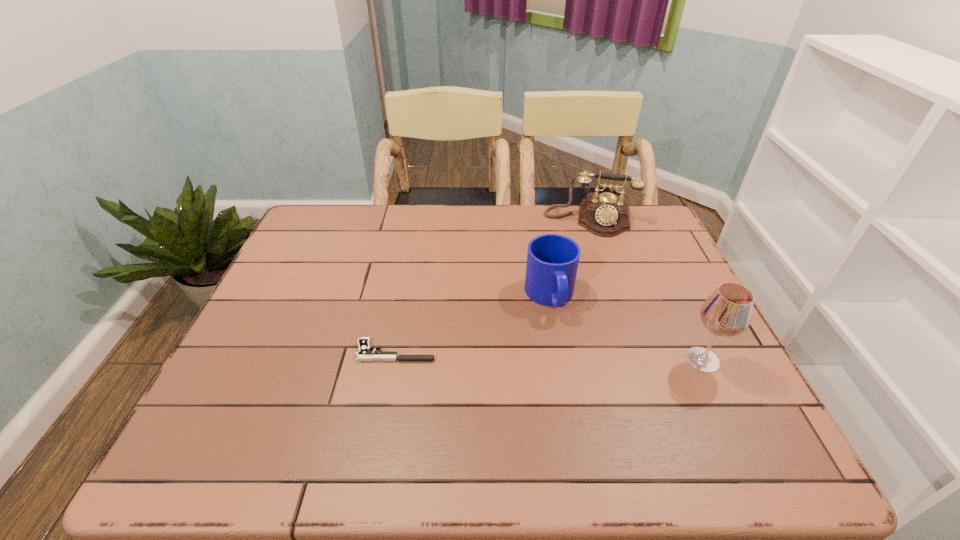
Where is `free space located 0.310m on the dial of the third shortest object`? free space located 0.310m on the dial of the third shortest object is located at coordinates (580, 305).

Locate an element on the screen. The width and height of the screenshot is (960, 540). vacant space positioned 0.240m on the dial of the third shortest object is located at coordinates (582, 288).

Where is `blank area located 0.060m on the side with the handle of the second shortest object`? blank area located 0.060m on the side with the handle of the second shortest object is located at coordinates [563, 339].

The image size is (960, 540). In order to click on vacant space situated 0.110m on the side with the handle of the second shortest object in this screenshot , I will do `click(568, 356)`.

Image resolution: width=960 pixels, height=540 pixels. I want to click on vacant space situated 0.160m on the side with the handle of the second shortest object, so click(x=574, y=373).

The height and width of the screenshot is (540, 960). Find the location of `object that is at the far edge`. object that is at the far edge is located at coordinates (606, 215).

The width and height of the screenshot is (960, 540). Identify the location of wineglass that is at the right edge. (727, 312).

The image size is (960, 540). Find the location of `telephone that is at the right edge`. telephone that is at the right edge is located at coordinates coord(606,215).

At what (x,y) coordinates should I click in order to perform the action: click on object positioned at the far right corner. Please return your answer as a coordinate pair (x, y). Looking at the image, I should click on (606, 215).

Find the location of `free space at the far edge of the desktop`. free space at the far edge of the desktop is located at coordinates (582, 230).